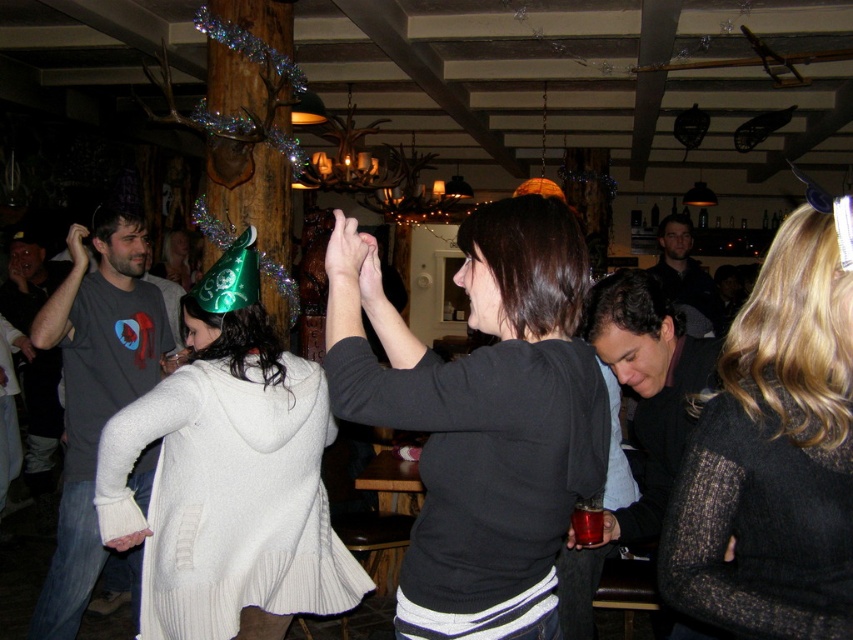
Question: Which point is farther to the camera?

Choices:
 (A) black matte sweater at center
 (B) black textured sweater at right

Answer: (A)

Question: Does white knitted sweater at center appear on the left side of black textured sweater at right?

Choices:
 (A) no
 (B) yes

Answer: (B)

Question: Which is farther from the black matte sweater at center?

Choices:
 (A) white knitted sweater at center
 (B) black textured sweater at right

Answer: (A)

Question: Does white knitted sweater at center have a lesser width compared to black textured sweater at right?

Choices:
 (A) no
 (B) yes

Answer: (A)

Question: Is white knitted sweater at center to the right of black textured sweater at right from the viewer's perspective?

Choices:
 (A) yes
 (B) no

Answer: (B)

Question: Which point appears farthest from the camera in this image?

Choices:
 (A) (833, 272)
 (B) (386, 316)

Answer: (B)